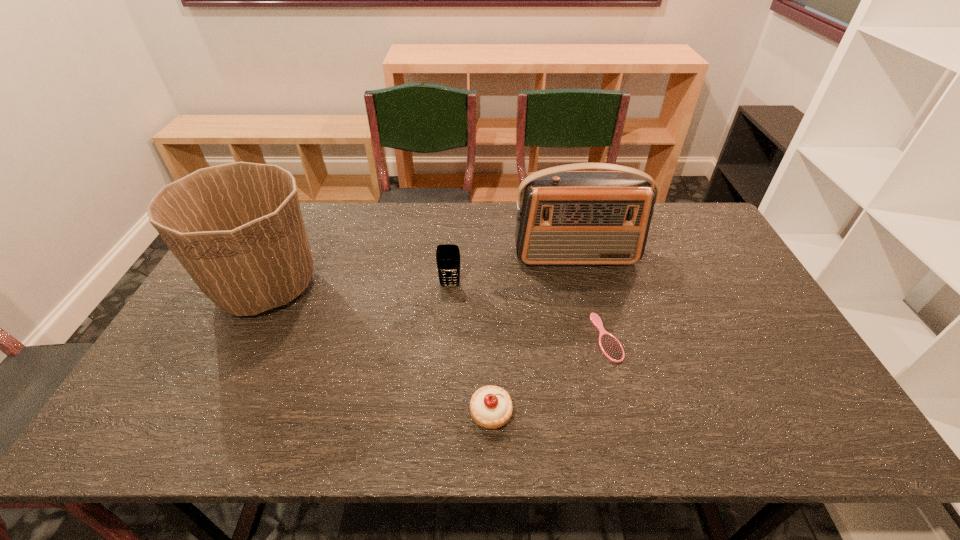
This screenshot has height=540, width=960. What are the coordinates of `free area in between the hairbrush and the fourth object from right to left` in the screenshot? It's located at (528, 312).

Where is `free point between the shortest object and the radio receiver`? free point between the shortest object and the radio receiver is located at coordinates (591, 297).

What are the coordinates of `unoccupied position between the leftmost object and the shortest object` in the screenshot? It's located at (437, 312).

Where is `vacant region between the third tallest object and the radio receiver`? vacant region between the third tallest object and the radio receiver is located at coordinates (513, 271).

Image resolution: width=960 pixels, height=540 pixels. In order to click on free space between the shortest object and the nearest object in this screenshot , I will do `click(549, 375)`.

Where is `vacant area that lies between the second object from left to right and the shortest object`? This screenshot has width=960, height=540. vacant area that lies between the second object from left to right and the shortest object is located at coordinates (528, 312).

Identify the location of free area in between the hairbrush and the radio receiver. Image resolution: width=960 pixels, height=540 pixels. (591, 297).

Image resolution: width=960 pixels, height=540 pixels. What are the coordinates of `free point between the third object from left to right and the radio receiver` in the screenshot? It's located at coord(534,335).

Locate which object ranks in proximity to the nearest object. Please provide its 2D coordinates. Your answer should be formatted as a tuple, i.e. [(x, y)], where the tuple contains the x and y coordinates of a point satisfying the conditions above.

[(611, 347)]

Identify which object is located as the nearest to the flowerpot. Please provide its 2D coordinates. Your answer should be formatted as a tuple, i.e. [(x, y)], where the tuple contains the x and y coordinates of a point satisfying the conditions above.

[(447, 255)]